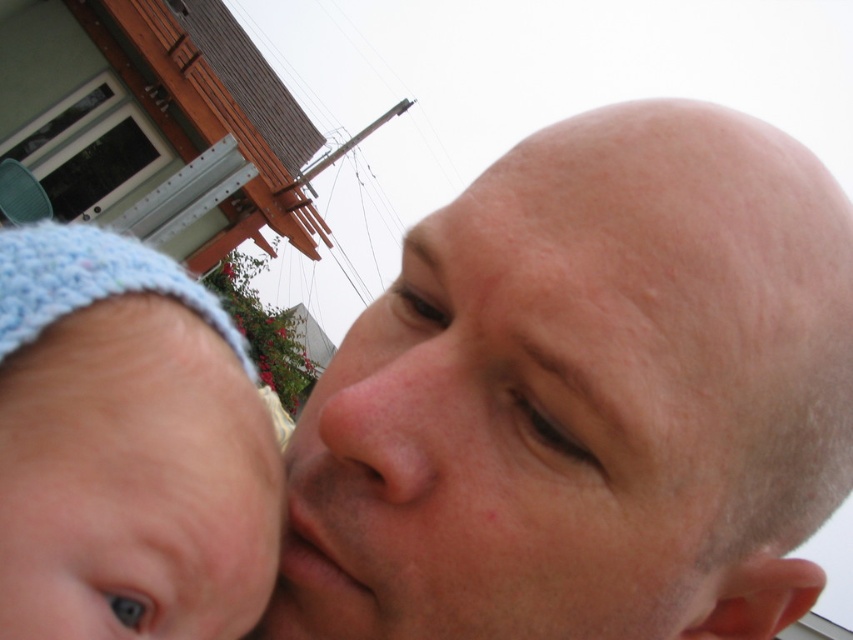
Question: Which point is farther to the camera?

Choices:
 (A) pink smooth skin at center
 (B) smooth skin head at center

Answer: (A)

Question: Does knitted blue hat at left appear under pink smooth skin at center?

Choices:
 (A) no
 (B) yes

Answer: (A)

Question: Which object appears closest to the camera in this image?

Choices:
 (A) smooth skin head at center
 (B) pink smooth skin at center

Answer: (A)

Question: Which point is farther to the camera?

Choices:
 (A) smooth skin head at center
 (B) knitted blue hat at left
 (C) pink smooth skin at center

Answer: (C)

Question: Can you confirm if knitted blue hat at left is bigger than pink smooth skin at center?

Choices:
 (A) no
 (B) yes

Answer: (B)

Question: Does smooth skin head at center appear on the left side of pink smooth skin at center?

Choices:
 (A) no
 (B) yes

Answer: (A)